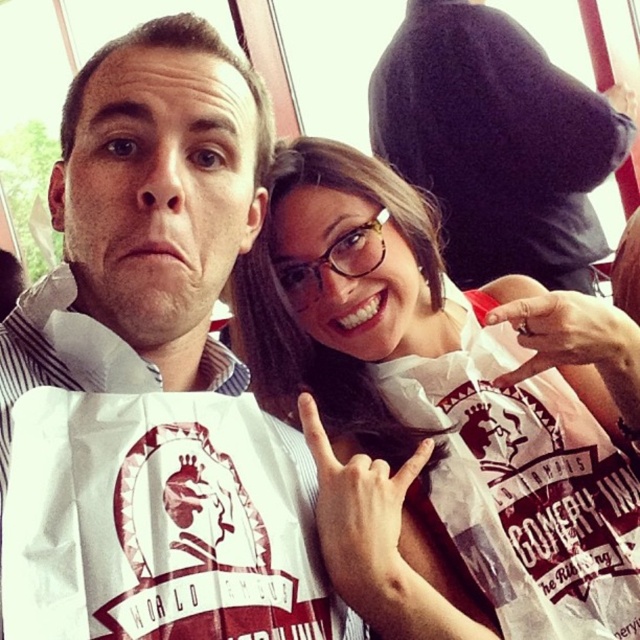
Question: Where is white paper bag at center located in relation to matte black shirt at upper center in the image?

Choices:
 (A) right
 (B) left

Answer: (B)

Question: From the image, what is the correct spatial relationship of white paper bag at center in relation to matte black shirt at upper center?

Choices:
 (A) below
 (B) above

Answer: (A)

Question: Does white paper bag at center appear over matte black shirt at upper center?

Choices:
 (A) yes
 (B) no

Answer: (B)